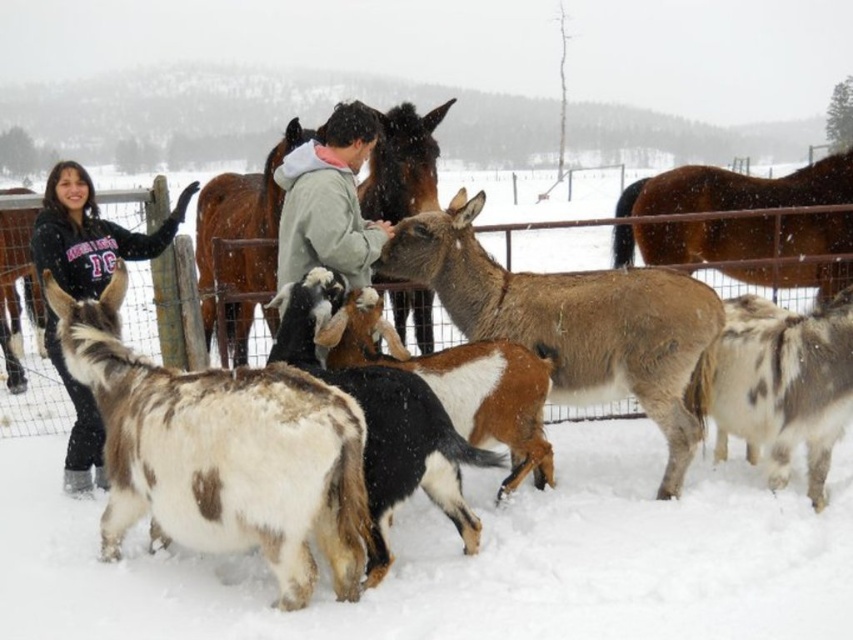
Question: Which point is closer to the camera taking this photo?

Choices:
 (A) (721, 192)
 (B) (657, 333)
 (C) (334, 202)
 (D) (323, 476)

Answer: (D)

Question: Observing the image, what is the correct spatial positioning of brown speckled fur at center in reference to gray fleece jacket at center?

Choices:
 (A) below
 (B) above

Answer: (A)

Question: Which object is positioned closest to the spotted fur goat at center?

Choices:
 (A) gray fleece jacket at center
 (B) black fleece jacket at left
 (C) brown speckled fur at center
 (D) brown glossy horse at upper right

Answer: (C)

Question: Which point is farther to the camera?

Choices:
 (A) (181, 198)
 (B) (287, 289)
 (C) (321, 129)
 (D) (184, 541)

Answer: (A)

Question: Does brown glossy horse at upper right appear on the left side of brown glossy horse at center?

Choices:
 (A) no
 (B) yes

Answer: (A)

Question: Is brown glossy horse at upper right thinner than white and brown fur goat at center?

Choices:
 (A) yes
 (B) no

Answer: (B)